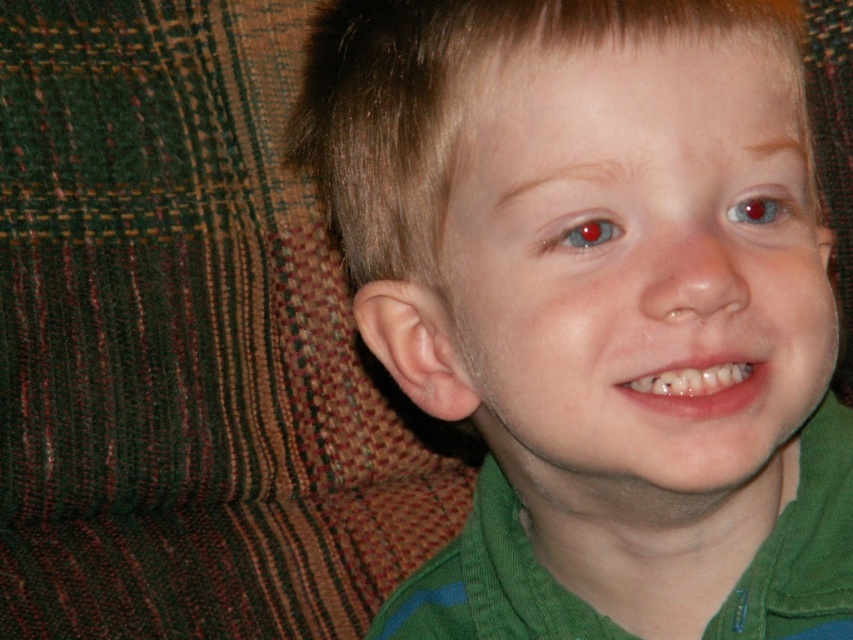
You are a photographer adjusting the lighting for a portrait. You notice the green corduroy shirt at center and the red glossy eye at upper center in your frame. Which object should you focus on first if you want to ensure the larger object is properly lit?

The green corduroy shirt at center should be focused on first because its width is larger than the red glossy eye at upper center, making it the larger object needing proper lighting.

Looking at the image of the child, where is the green corduroy shirt at center in relation to the glossy blue eye at upper center?

The green corduroy shirt at center is to the left of the glossy blue eye at upper center.

You are a photographer adjusting the lighting for a portrait. You notice the child has two eyes visible in the frame. Which eye, the glossy blue eye at upper center or the red glossy eye at upper center, is closer to the camera?

The glossy blue eye at upper center is closer to the camera because it is in front of the red glossy eye at upper center.